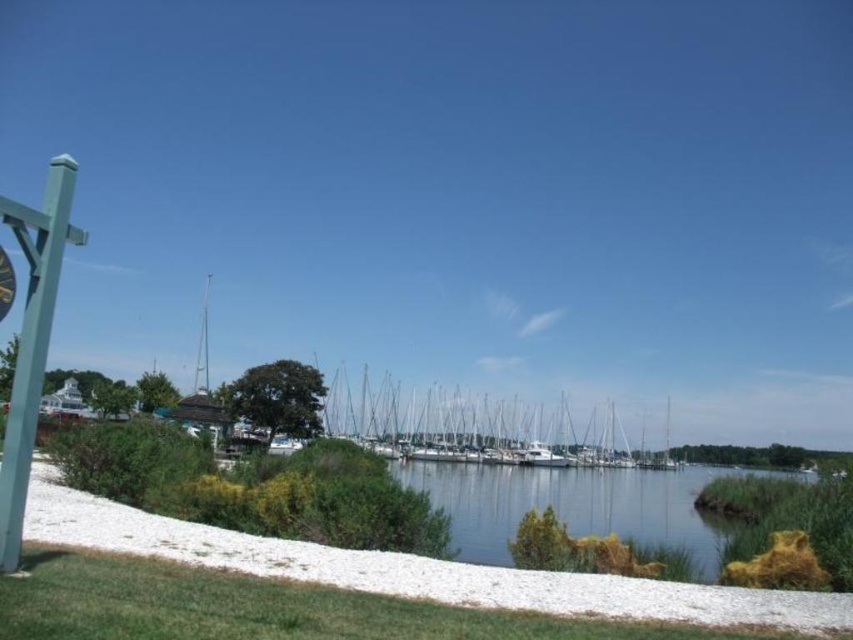
Question: Among these objects, which one is farthest from the camera?

Choices:
 (A) white glossy boats at center
 (B) green painted wood post at left

Answer: (A)

Question: Which point is closer to the camera?

Choices:
 (A) (13, 275)
 (B) (440, 420)
 (C) (9, 470)

Answer: (A)

Question: Is green painted wood post at left bigger than metallic gold clock at left?

Choices:
 (A) no
 (B) yes

Answer: (B)

Question: Can you confirm if green painted wood post at left is wider than metallic gold clock at left?

Choices:
 (A) no
 (B) yes

Answer: (B)

Question: Can you confirm if white glossy boats at center is positioned to the left of green painted wood post at left?

Choices:
 (A) yes
 (B) no

Answer: (B)

Question: Which point is farther to the camera?

Choices:
 (A) (474, 426)
 (B) (47, 268)
 (C) (4, 266)

Answer: (A)